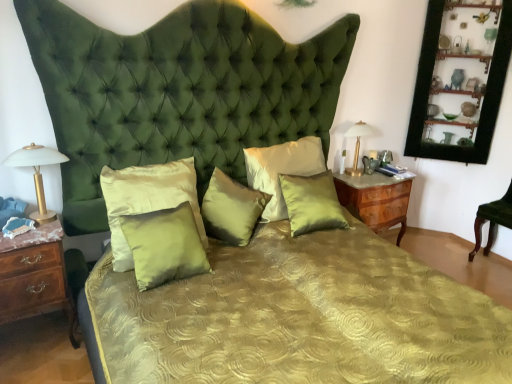
Question: From the image's perspective, relative to satin green pillow at center, positioned as the third pillow in right-to-left order, is black wood picture frame at upper right above or below?

Choices:
 (A) above
 (B) below

Answer: (A)

Question: From a real-world perspective, relative to satin green pillow at center, positioned as the third pillow in right-to-left order, is black wood picture frame at upper right vertically above or below?

Choices:
 (A) above
 (B) below

Answer: (A)

Question: Considering the real-world distances, which object is farthest from the satin green pillow at center, which appears as the fifth pillow when viewed from the left?

Choices:
 (A) satin green pillow at center, the third pillow in the left-to-right sequence
 (B) matte gold table lamp at left, which is the 1th bedside lamp in left-to-right order
 (C) satin/velvet pillow at center, which is counted as the first pillow, starting from the left
 (D) black wood picture frame at upper right
 (E) gold metallic lamp at right, the 2th bedside lamp when ordered from left to right

Answer: (D)

Question: Estimate the real-world distances between objects in this image. Which object is farther from the satin green pillow at center, the third pillow in the left-to-right sequence?

Choices:
 (A) green velvet chair at lower right
 (B) wooden nightstand at right, which is the 2th nightstand in front-to-back order
 (C) black wood picture frame at upper right
 (D) satin/velvet pillow at center, which is counted as the first pillow, starting from the left
 (E) gold metallic lamp at right, which is the second bedside lamp from front to back

Answer: (A)